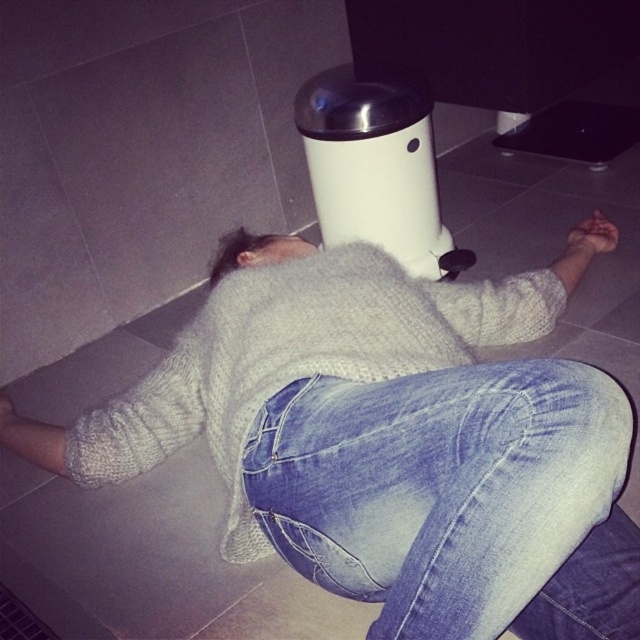
Can you confirm if white knitted sweater at center is taller than white matte water heater at center?

Incorrect, white knitted sweater at center's height is not larger of white matte water heater at center's.

Is point (476, 348) closer to viewer compared to point (376, 100)?

Yes.

The height and width of the screenshot is (640, 640). I want to click on white knitted sweater at center, so click(298, 358).

Does denim jeans at lower center have a lesser width compared to white matte water heater at center?

In fact, denim jeans at lower center might be wider than white matte water heater at center.

Who is lower down, denim jeans at lower center or white matte water heater at center?

Positioned lower is denim jeans at lower center.

Locate an element on the screen. The image size is (640, 640). denim jeans at lower center is located at coordinates (456, 499).

This screenshot has height=640, width=640. Identify the location of denim jeans at lower center. (456, 499).

Who is more forward, (406,531) or (298,300)?

Point (406,531)

Can you confirm if denim jeans at lower center is positioned to the left of white knitted sweater at center?

In fact, denim jeans at lower center is to the right of white knitted sweater at center.

What do you see at coordinates (456, 499) in the screenshot? I see `denim jeans at lower center` at bounding box center [456, 499].

Locate an element on the screen. denim jeans at lower center is located at coordinates (456, 499).